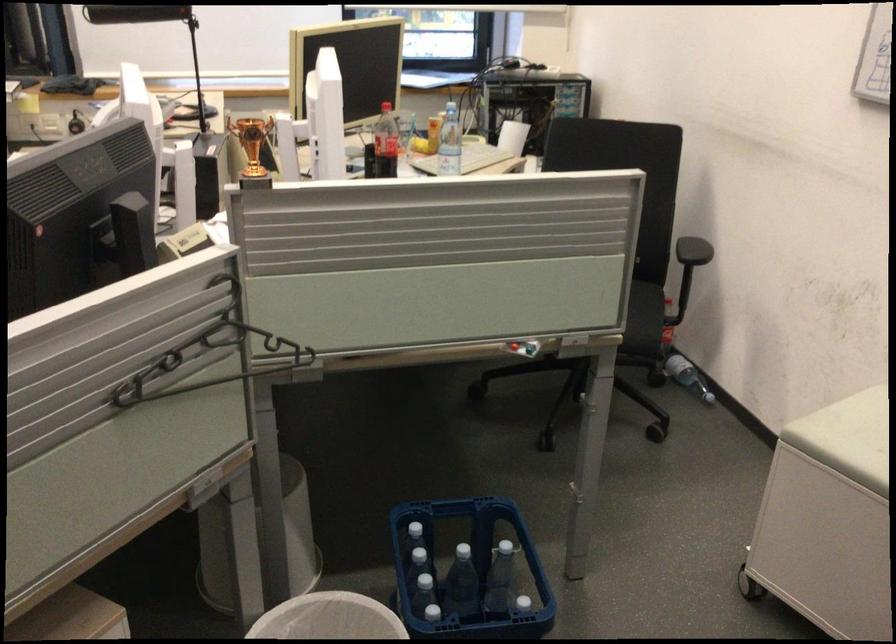
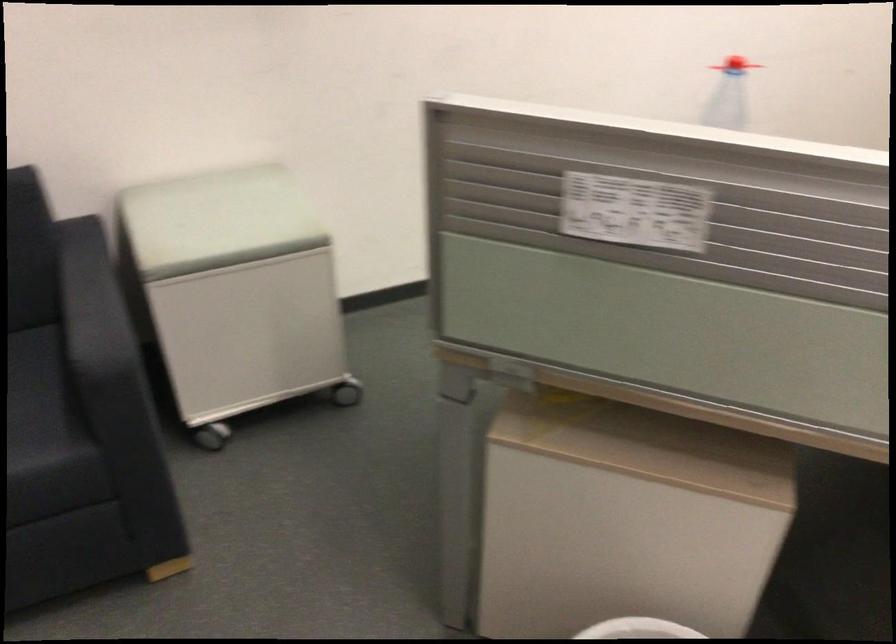
The first image is from the beginning of the video and the second image is from the end. How did the camera likely rotate when shooting the video?

The rotation direction of the camera is left-down.